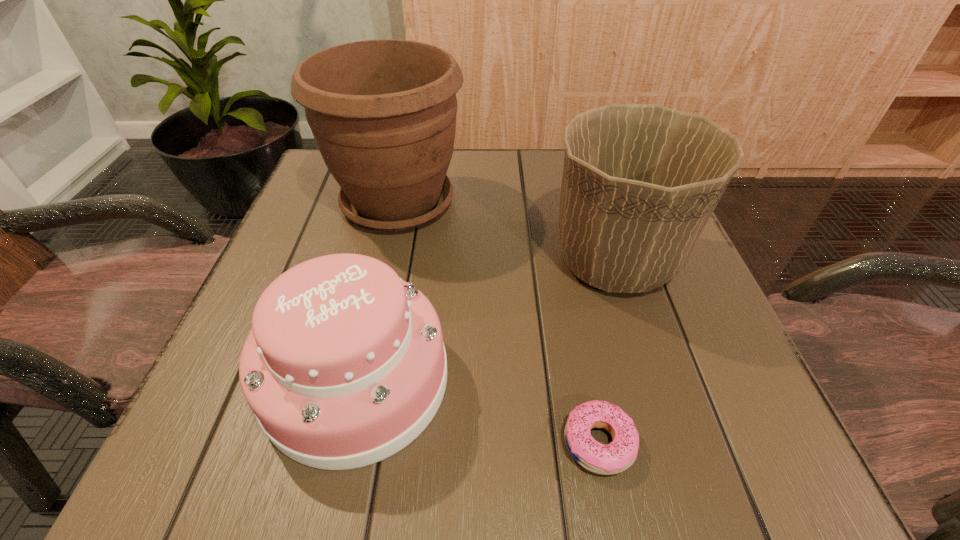
I want to click on cake located at the near edge, so click(345, 365).

Where is `doughnut that is at the near edge`? doughnut that is at the near edge is located at coordinates (620, 454).

The height and width of the screenshot is (540, 960). I want to click on flowerpot that is at the left edge, so click(382, 112).

The image size is (960, 540). In order to click on cake present at the left edge in this screenshot , I will do `click(345, 365)`.

You are a GUI agent. You are given a task and a screenshot of the screen. Output one action in this format:
    pyautogui.click(x=<x>, y=<y>)
    Task: Click on the object present at the right edge
    The width and height of the screenshot is (960, 540).
    Given the screenshot: What is the action you would take?
    pyautogui.click(x=640, y=182)

I want to click on object situated at the far left corner, so click(x=382, y=112).

This screenshot has height=540, width=960. In order to click on object situated at the near left corner in this screenshot , I will do `click(345, 365)`.

Identify the location of vacant region at the far edge. This screenshot has width=960, height=540. pyautogui.click(x=504, y=199).

At what (x,y) coordinates should I click in order to perform the action: click on vacant space at the left edge of the desktop. Please return your answer as a coordinate pair (x, y). This screenshot has width=960, height=540. Looking at the image, I should click on (306, 259).

Where is `free region at the right edge`? Image resolution: width=960 pixels, height=540 pixels. free region at the right edge is located at coordinates (706, 398).